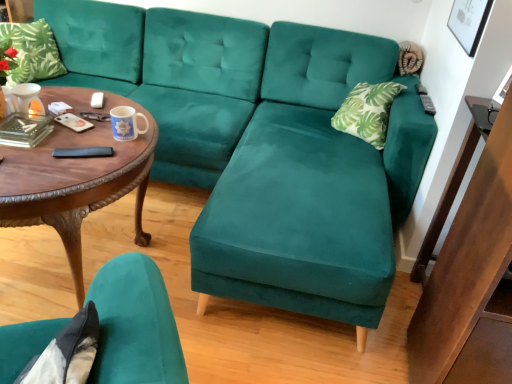
Question: Are green leafy fabric pillow at upper left and velvet teal chair at lower left beside each other?

Choices:
 (A) no
 (B) yes

Answer: (A)

Question: From the image's perspective, is green leafy fabric pillow at upper left located beneath velvet teal chair at lower left?

Choices:
 (A) yes
 (B) no

Answer: (B)

Question: From a real-world perspective, is green leafy fabric pillow at upper left physically above velvet teal chair at lower left?

Choices:
 (A) no
 (B) yes

Answer: (B)

Question: Is green leafy fabric pillow at upper left not within velvet teal chair at lower left?

Choices:
 (A) no
 (B) yes

Answer: (B)

Question: Can you confirm if green leafy fabric pillow at upper left is wider than velvet teal chair at lower left?

Choices:
 (A) yes
 (B) no

Answer: (B)

Question: Is green leafy fabric pillow at upper left far from velvet teal chair at lower left?

Choices:
 (A) yes
 (B) no

Answer: (A)

Question: From a real-world perspective, does woodencoffee table at left sit lower than green leafy fabric pillow at upper left?

Choices:
 (A) no
 (B) yes

Answer: (B)

Question: Is woodencoffee table at left to the left of green leafy fabric pillow at upper left from the viewer's perspective?

Choices:
 (A) no
 (B) yes

Answer: (A)

Question: Considering the relative sizes of woodencoffee table at left and green leafy fabric pillow at upper left in the image provided, is woodencoffee table at left thinner than green leafy fabric pillow at upper left?

Choices:
 (A) no
 (B) yes

Answer: (A)

Question: Is woodencoffee table at left behind green leafy fabric pillow at upper left?

Choices:
 (A) yes
 (B) no

Answer: (B)

Question: From the image's perspective, does woodencoffee table at left appear higher than green leafy fabric pillow at upper left?

Choices:
 (A) yes
 (B) no

Answer: (B)

Question: Is woodencoffee table at left outside of green leafy fabric pillow at upper left?

Choices:
 (A) no
 (B) yes

Answer: (B)

Question: Considering the relative sizes of green leafy fabric pillow at upper left and woodencoffee table at left in the image provided, is green leafy fabric pillow at upper left shorter than woodencoffee table at left?

Choices:
 (A) no
 (B) yes

Answer: (B)